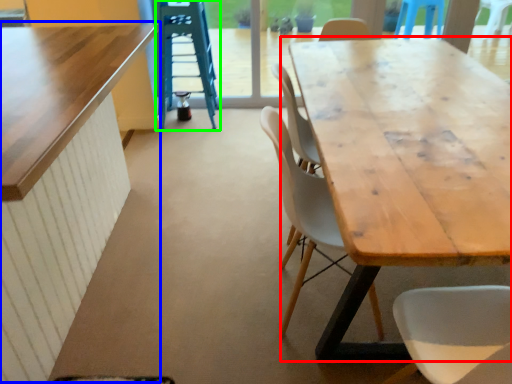
Question: Based on their relative distances, which object is farther from table (highlighted by a red box)? Choose from table (highlighted by a blue box) and ladder (highlighted by a green box).

Choices:
 (A) table
 (B) ladder

Answer: (B)